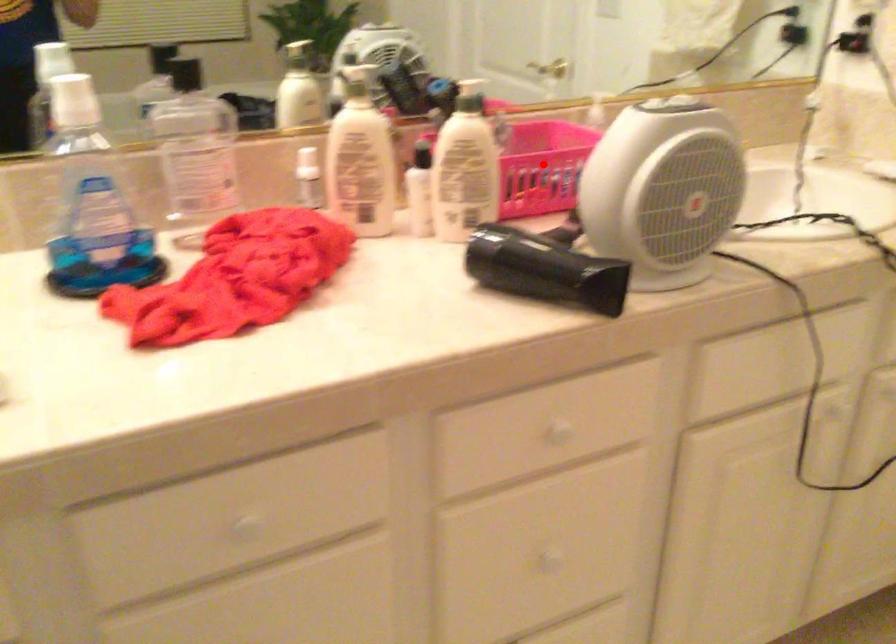
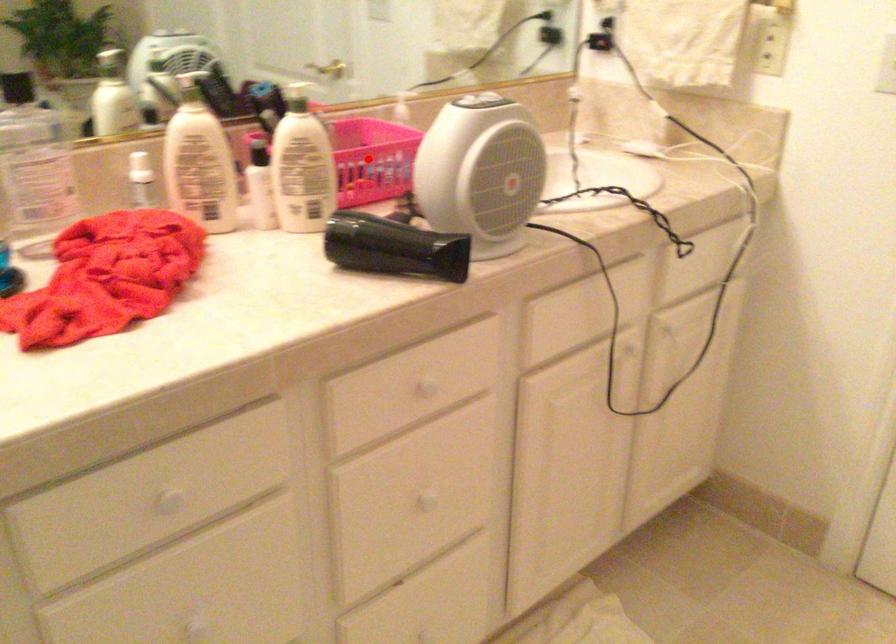
I am providing you with two images of the same scene from different viewpoints. A red point is marked on the first image and another point is marked on the second image. Is the marked point in image1 the same physical position as the marked point in image2?

Yes